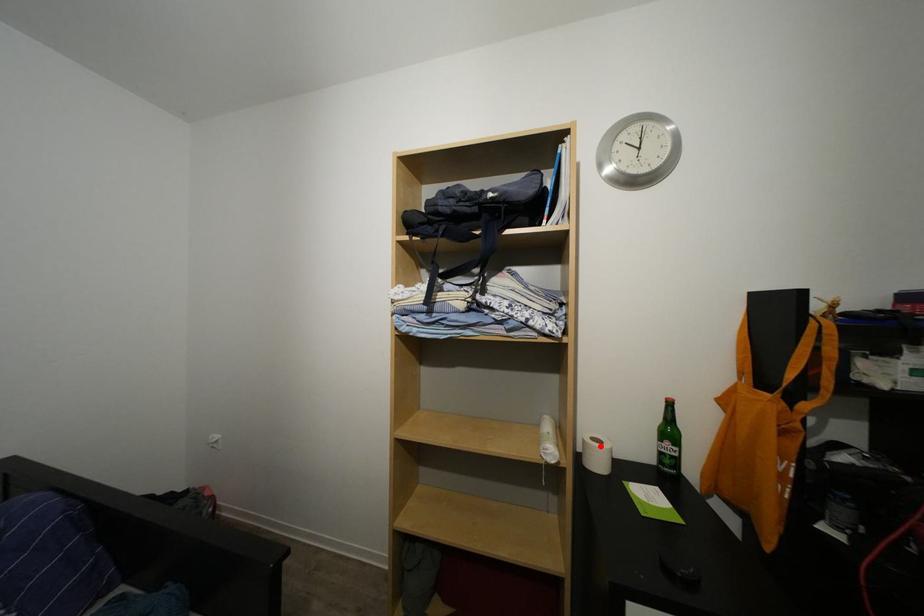
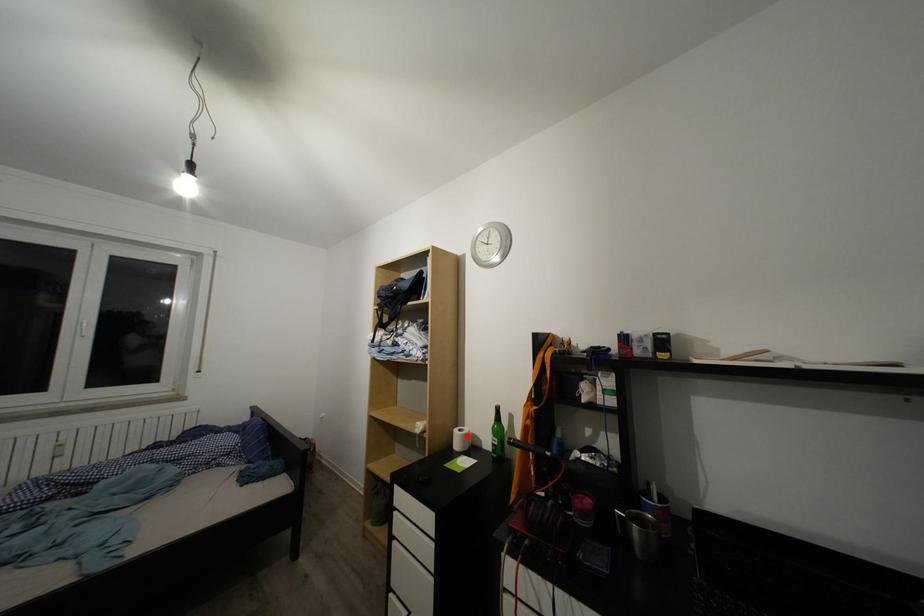
From the picture: I am providing you with two images of the same scene from different viewpoints. A red point is marked on the first image and another point is marked on the second image. Is the red point in image1 aligned with the point shown in image2?

Yes